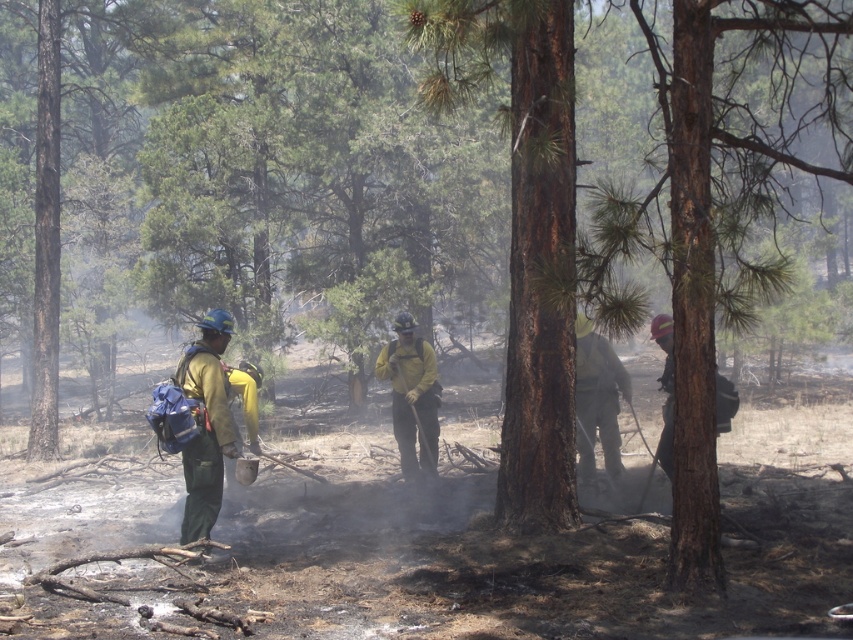
You are a firefighter in the forest and need to reach both the point at coordinates point (187, 506) and point (431, 444). Which point should you head to first if you want to tackle the closest hotspot first?

You should head to point (187, 506) first because it is closer to you than point (431, 444).

You are a firefighter in the forest and need to reach both the point at coordinates point (210, 515) and point (592, 472). Which point should you reach first to ensure you are moving towards the nearest location?

You should reach point (210, 515) first because it is closer to you than point (592, 472).